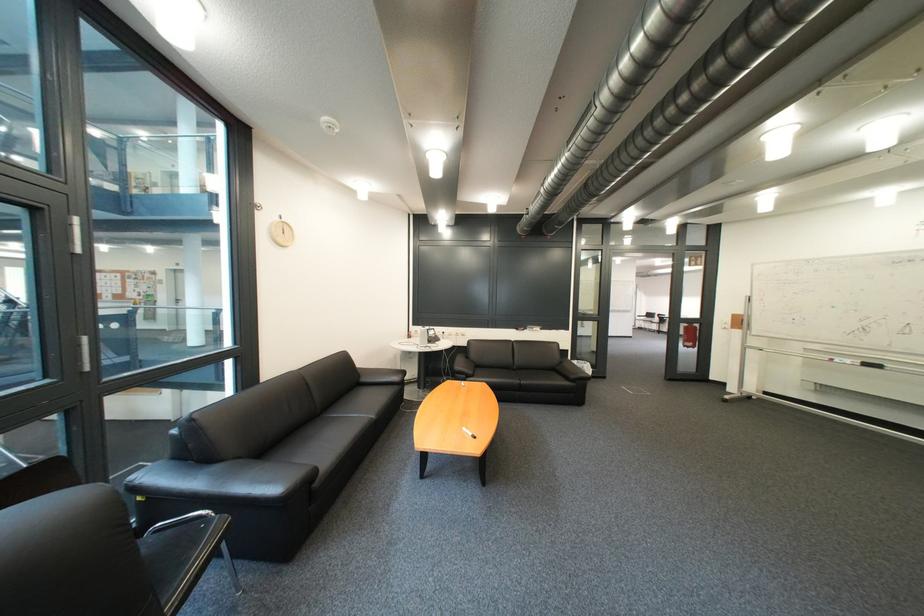
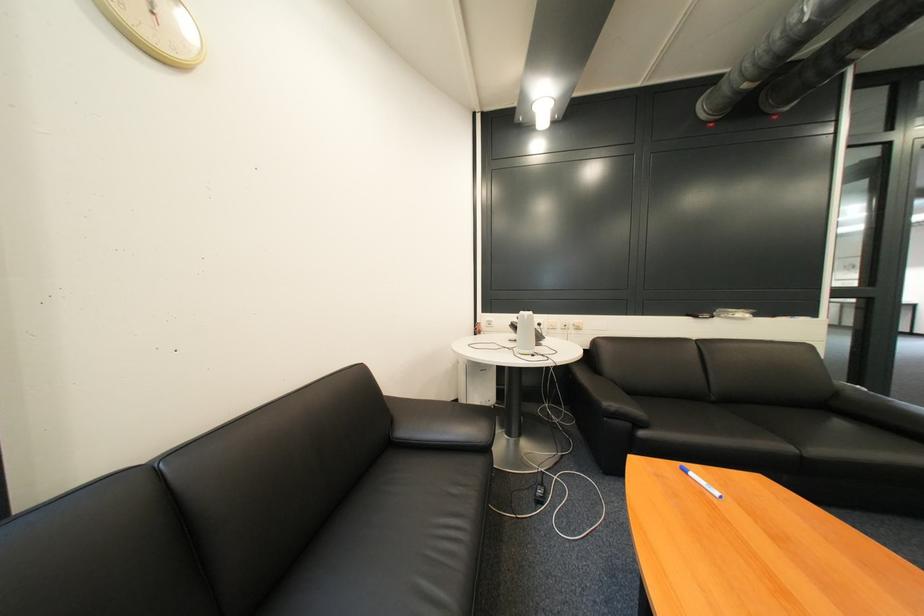
In a continuous first-person perspective shot, in which direction is the camera moving?

The movement direction of the cameraman is left, forward.